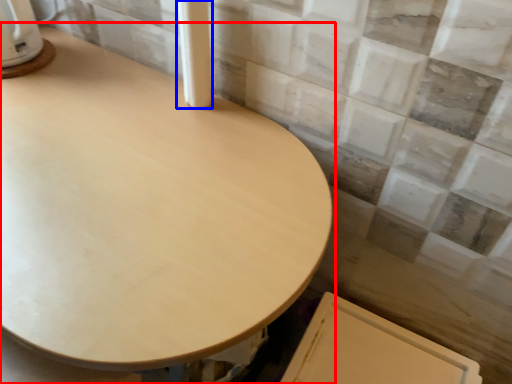
Question: Which object appears closest to the camera in this image, table (highlighted by a red box) or pillar (highlighted by a blue box)?

Choices:
 (A) table
 (B) pillar

Answer: (A)